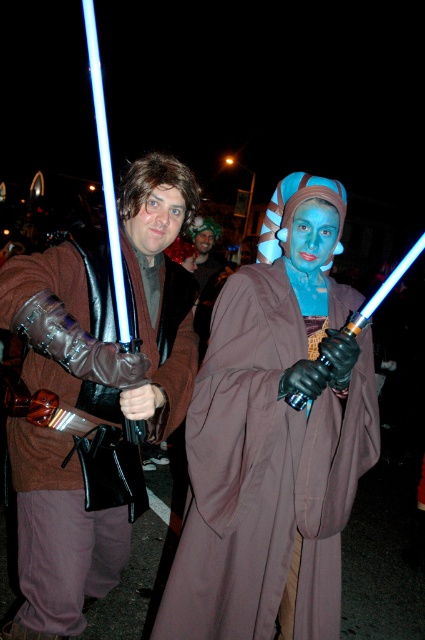
Question: Does matte brown robe at center have a greater width compared to blue matte face at center?

Choices:
 (A) yes
 (B) no

Answer: (A)

Question: Is blue matte/light brown robe at center to the right of matte brown robe at center from the viewer's perspective?

Choices:
 (A) no
 (B) yes

Answer: (B)

Question: Which of the following is the closest to the observer?

Choices:
 (A) (217, 506)
 (B) (328, 218)
 (C) (82, 552)
 (D) (212, 240)

Answer: (C)

Question: Which point is farther from the camera taking this photo?

Choices:
 (A) (212, 240)
 (B) (164, 186)

Answer: (A)

Question: Can you confirm if shiny silver lightsaber at center is positioned above matte brown robe at center?

Choices:
 (A) no
 (B) yes

Answer: (A)

Question: Which of the following is the closest to the observer?

Choices:
 (A) smooth skin face at center
 (B) shiny silver lightsaber at center
 (C) matte brown hair at center
 (D) blue matte/light brown robe at center

Answer: (B)